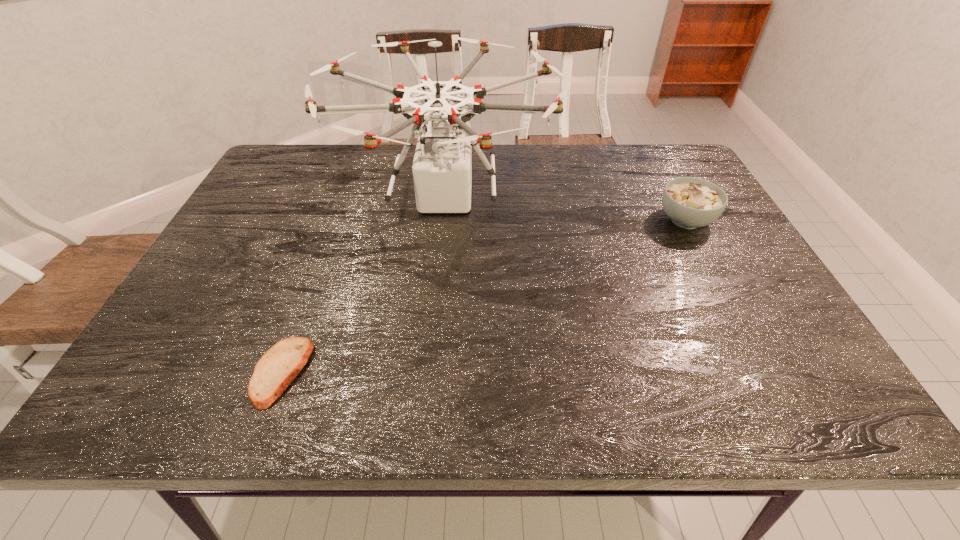
What are the coordinates of `free spot between the shortest object and the soup bowl` in the screenshot? It's located at (484, 296).

Identify the location of free space between the tallest object and the soup bowl. (565, 208).

Where is `empty space between the pita bread and the drone`? The width and height of the screenshot is (960, 540). empty space between the pita bread and the drone is located at coordinates (364, 285).

The image size is (960, 540). What are the coordinates of `vacant space in between the pita bread and the tallest object` in the screenshot? It's located at (364, 285).

Image resolution: width=960 pixels, height=540 pixels. Find the location of `free space between the pita bread and the soup bowl`. free space between the pita bread and the soup bowl is located at coordinates (484, 296).

You are a GUI agent. You are given a task and a screenshot of the screen. Output one action in this format:
    pyautogui.click(x=<x>, y=<y>)
    Task: Click on the empty location between the nearest object and the second tallest object
    This screenshot has width=960, height=540.
    Given the screenshot: What is the action you would take?
    [484, 296]

Where is `free space between the rightmost object and the tallest object`? free space between the rightmost object and the tallest object is located at coordinates (565, 208).

You are a GUI agent. You are given a task and a screenshot of the screen. Output one action in this format:
    pyautogui.click(x=<x>, y=<y>)
    Task: Click on the second closest object to the second shortest object
    
    Given the screenshot: What is the action you would take?
    pyautogui.click(x=278, y=367)

The image size is (960, 540). What are the coordinates of `object that is the closest one to the rightmost object` in the screenshot? It's located at (442, 167).